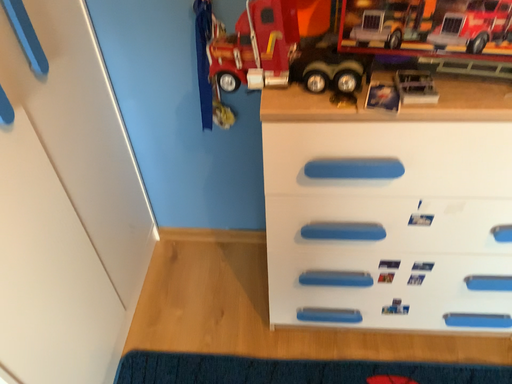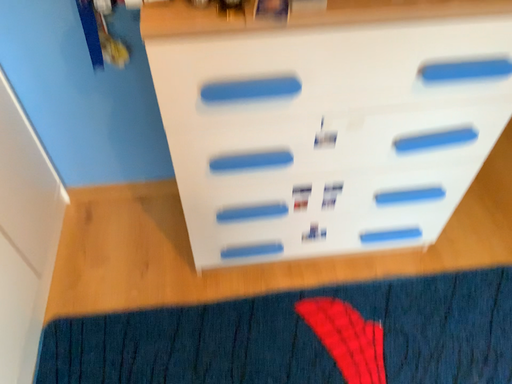
Question: How did the camera likely rotate when shooting the video?

Choices:
 (A) rotated right
 (B) rotated left

Answer: (A)